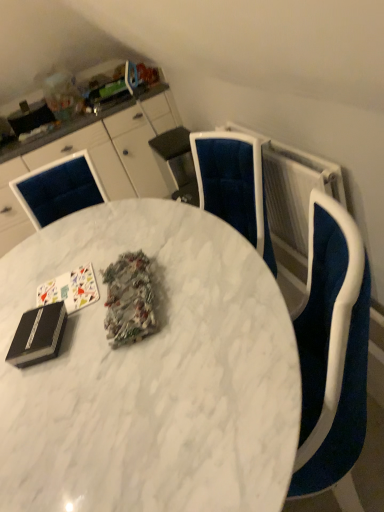
Question: From a real-world perspective, is white matte card game at upper left under white glossy cabinets at upper left?

Choices:
 (A) no
 (B) yes

Answer: (A)

Question: Does white matte card game at upper left come behind white glossy cabinets at upper left?

Choices:
 (A) yes
 (B) no

Answer: (B)

Question: Does white matte card game at upper left have a smaller size compared to white glossy cabinets at upper left?

Choices:
 (A) no
 (B) yes

Answer: (B)

Question: From the image's perspective, is white matte card game at upper left above white glossy cabinets at upper left?

Choices:
 (A) yes
 (B) no

Answer: (B)

Question: From the image's perspective, would you say white matte card game at upper left is shown under white glossy cabinets at upper left?

Choices:
 (A) no
 (B) yes

Answer: (B)

Question: From the image's perspective, is white textured radiator at upper right above or below white marble table at center?

Choices:
 (A) below
 (B) above

Answer: (B)

Question: Considering the positions of white textured radiator at upper right and white marble table at center in the image, is white textured radiator at upper right bigger or smaller than white marble table at center?

Choices:
 (A) small
 (B) big

Answer: (A)

Question: Considering the positions of white textured radiator at upper right and white marble table at center in the image, is white textured radiator at upper right taller or shorter than white marble table at center?

Choices:
 (A) short
 (B) tall

Answer: (A)

Question: Considering the positions of point (309, 165) and point (238, 236), is point (309, 165) closer or farther from the camera than point (238, 236)?

Choices:
 (A) farther
 (B) closer

Answer: (A)

Question: In terms of width, does shiny metallic foil at center look wider or thinner when compared to white glossy cabinets at upper left?

Choices:
 (A) thin
 (B) wide

Answer: (A)

Question: Considering their positions, is shiny metallic foil at center located in front of or behind white glossy cabinets at upper left?

Choices:
 (A) behind
 (B) front

Answer: (B)

Question: In terms of height, does shiny metallic foil at center look taller or shorter compared to white glossy cabinets at upper left?

Choices:
 (A) short
 (B) tall

Answer: (A)

Question: Do you think shiny metallic foil at center is within white glossy cabinets at upper left, or outside of it?

Choices:
 (A) outside
 (B) inside

Answer: (A)

Question: Which is correct: white textured radiator at upper right is inside white glossy cabinets at upper left, or outside of it?

Choices:
 (A) outside
 (B) inside

Answer: (A)

Question: From the image's perspective, is white textured radiator at upper right above or below white glossy cabinets at upper left?

Choices:
 (A) below
 (B) above

Answer: (A)